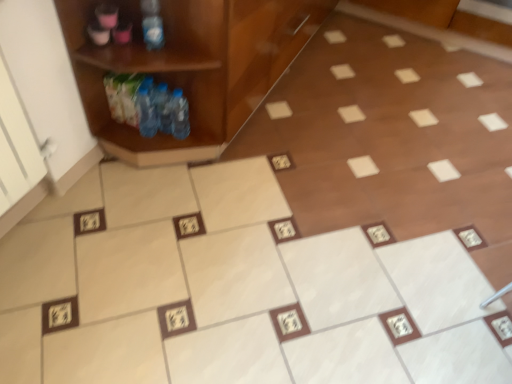
Question: From the image's perspective, relative to wooden cabinet at left, is translucent plastic bottle at left, which is the first bottle from bottom to top, above or below?

Choices:
 (A) below
 (B) above

Answer: (A)

Question: Looking at the image, does translucent plastic bottle at left, which is the first bottle from bottom to top, seem bigger or smaller compared to wooden cabinet at left?

Choices:
 (A) big
 (B) small

Answer: (B)

Question: Which object is positioned farthest from the wooden cabinet at left?

Choices:
 (A) blue plastic bottle at upper left, the second bottle ordered from the bottom
 (B) translucent plastic bottle at left, which is the first bottle from bottom to top

Answer: (A)

Question: Based on their relative distances, which object is nearer to the blue plastic bottle at upper left, the 1th bottle in the top-to-bottom sequence?

Choices:
 (A) wooden cabinet at left
 (B) translucent plastic bottle at left, which is the first bottle from bottom to top

Answer: (A)